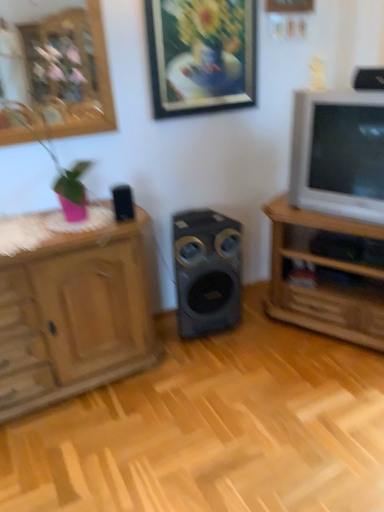
Question: Does wooden tv stand at right appear on the left side of black plastic speaker at upper left, which is counted as the third speaker, starting from the right?

Choices:
 (A) no
 (B) yes

Answer: (A)

Question: Considering the relative sizes of wooden tv stand at right and black plastic speaker at upper left, acting as the second speaker starting from the top, in the image provided, is wooden tv stand at right smaller than black plastic speaker at upper left, acting as the second speaker starting from the top,?

Choices:
 (A) no
 (B) yes

Answer: (A)

Question: From the image's perspective, does wooden tv stand at right appear lower than black plastic speaker at upper left, which is counted as the third speaker, starting from the right?

Choices:
 (A) yes
 (B) no

Answer: (A)

Question: Is there a large distance between wooden tv stand at right and black plastic speaker at upper left, the second speaker viewed from the back?

Choices:
 (A) no
 (B) yes

Answer: (B)

Question: Considering the relative sizes of wooden tv stand at right and black plastic speaker at upper left, which is the 1th speaker in left-to-right order, in the image provided, is wooden tv stand at right bigger than black plastic speaker at upper left, which is the 1th speaker in left-to-right order,?

Choices:
 (A) yes
 (B) no

Answer: (A)

Question: From the image's perspective, is black plastic speaker at upper left, acting as the second speaker starting from the top, above or below black plastic speaker at upper right, marked as the first speaker in a top-to-bottom arrangement?

Choices:
 (A) above
 (B) below

Answer: (B)

Question: From a real-world perspective, is black plastic speaker at upper left, which is counted as the third speaker, starting from the right, positioned above or below black plastic speaker at upper right, which appears as the first speaker when viewed from the right?

Choices:
 (A) above
 (B) below

Answer: (B)

Question: Considering the positions of point (124, 220) and point (377, 68), is point (124, 220) closer or farther from the camera than point (377, 68)?

Choices:
 (A) farther
 (B) closer

Answer: (B)

Question: Is black plastic speaker at upper left, acting as the second speaker starting from the top, inside the boundaries of black plastic speaker at upper right, which is the third speaker from left to right, or outside?

Choices:
 (A) outside
 (B) inside

Answer: (A)

Question: Looking at the image, does black plastic speaker at upper right, the third speaker positioned from the bottom, seem bigger or smaller compared to wooden tv stand at right?

Choices:
 (A) small
 (B) big

Answer: (A)

Question: From the image's perspective, is black plastic speaker at upper right, which is the third speaker from left to right, positioned above or below wooden tv stand at right?

Choices:
 (A) above
 (B) below

Answer: (A)

Question: Considering the relative positions of black plastic speaker at upper right, the third speaker positioned from the bottom, and wooden tv stand at right in the image provided, is black plastic speaker at upper right, the third speaker positioned from the bottom, to the left or to the right of wooden tv stand at right?

Choices:
 (A) right
 (B) left

Answer: (B)

Question: From a real-world perspective, is black plastic speaker at upper right, which is the third speaker from left to right, physically located above or below wooden tv stand at right?

Choices:
 (A) below
 (B) above

Answer: (B)

Question: Considering the relative positions of matte black speaker at center, the 3th speaker positioned from the top, and black plastic speaker at upper right, marked as the third speaker in a back-to-front arrangement, in the image provided, is matte black speaker at center, the 3th speaker positioned from the top, to the left or to the right of black plastic speaker at upper right, marked as the third speaker in a back-to-front arrangement,?

Choices:
 (A) left
 (B) right

Answer: (A)

Question: Is matte black speaker at center, acting as the second speaker starting from the right, situated inside black plastic speaker at upper right, which appears as the first speaker when viewed from the right, or outside?

Choices:
 (A) outside
 (B) inside

Answer: (A)